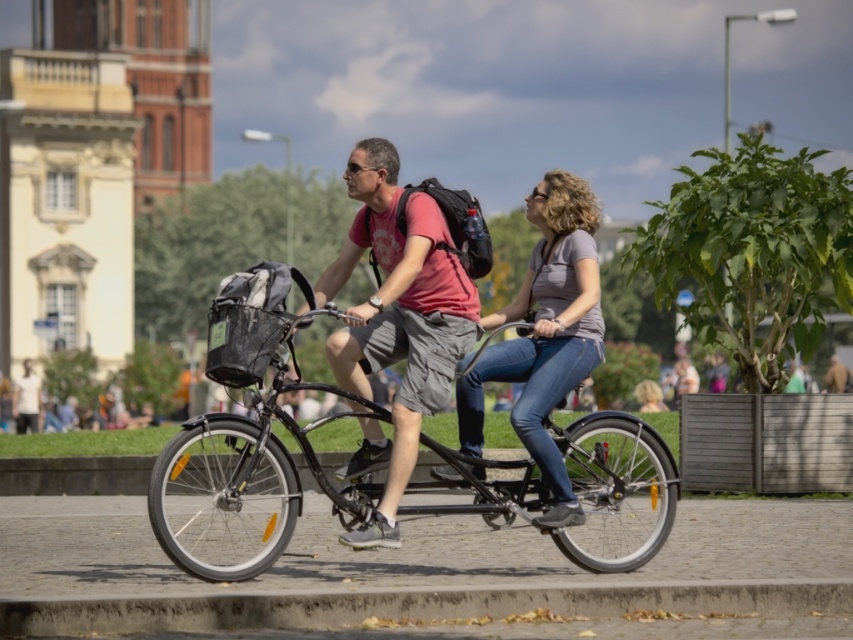
Question: Which point is farther from the camera taking this photo?

Choices:
 (A) (463, 419)
 (B) (392, 467)

Answer: (A)

Question: Can you confirm if shiny black bicycle at center is wider than matte red t-shirt at center?

Choices:
 (A) yes
 (B) no

Answer: (A)

Question: Among these points, which one is nearest to the camera?

Choices:
 (A) (454, 307)
 (B) (566, 525)

Answer: (B)

Question: Can you confirm if shiny black bicycle at center is bigger than matte red t-shirt at center?

Choices:
 (A) yes
 (B) no

Answer: (A)

Question: Does shiny black bicycle at center come behind matte red t-shirt at center?

Choices:
 (A) yes
 (B) no

Answer: (B)

Question: Which point is closer to the camera?

Choices:
 (A) (618, 451)
 (B) (357, 257)

Answer: (B)